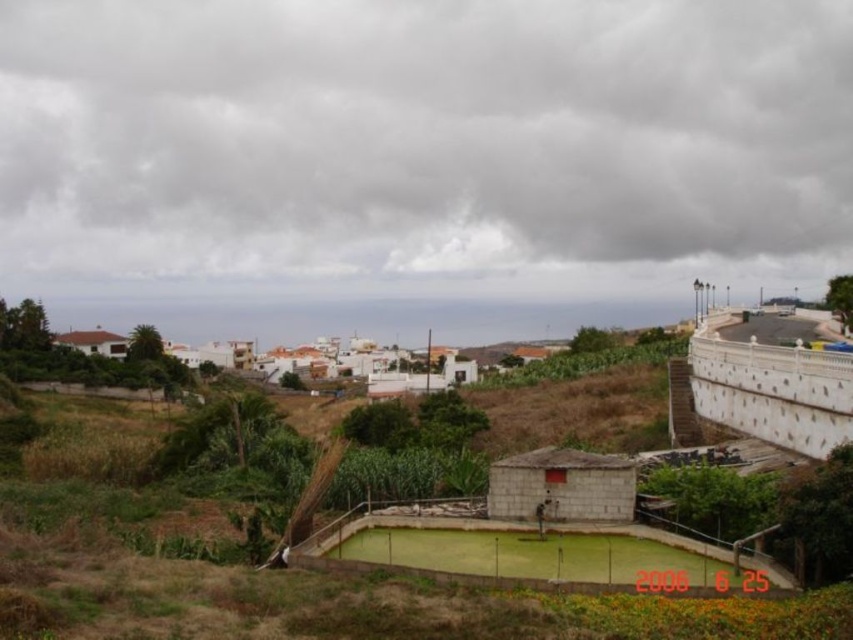
You are a bird flying over the rural landscape. You see the cloudy gray sky at upper center and the white matte houses at center. Which one appears taller from your perspective?

The cloudy gray sky at upper center appears taller than the white matte houses at center because it has a greater height compared to them.

You are standing in the rural landscape and want to take a photo of the white matte houses at center without the cloudy gray sky at upper center appearing in the frame. How should you adjust your camera angle?

Lower the camera angle so that the white matte houses at center are framed below the cloudy gray sky at upper center, excluding it from the shot.